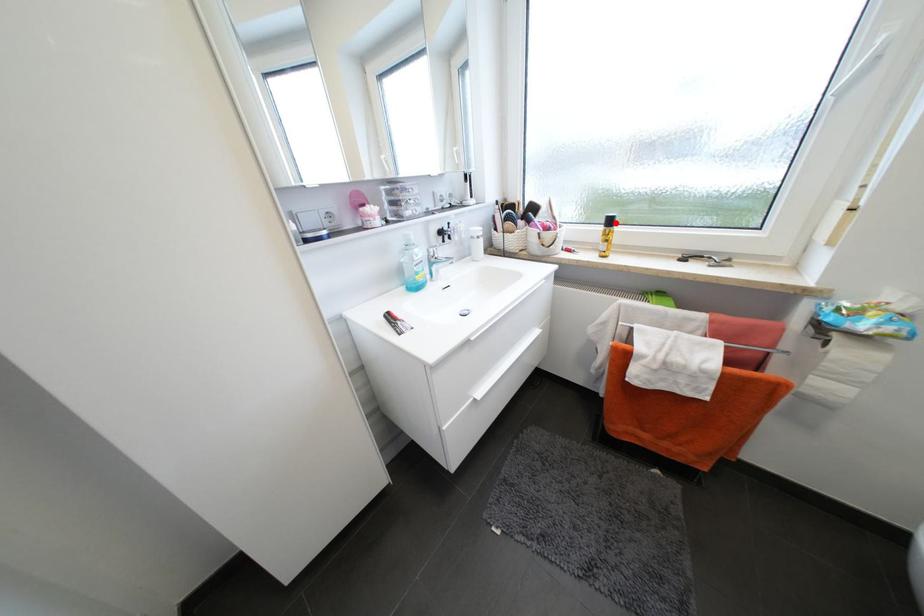
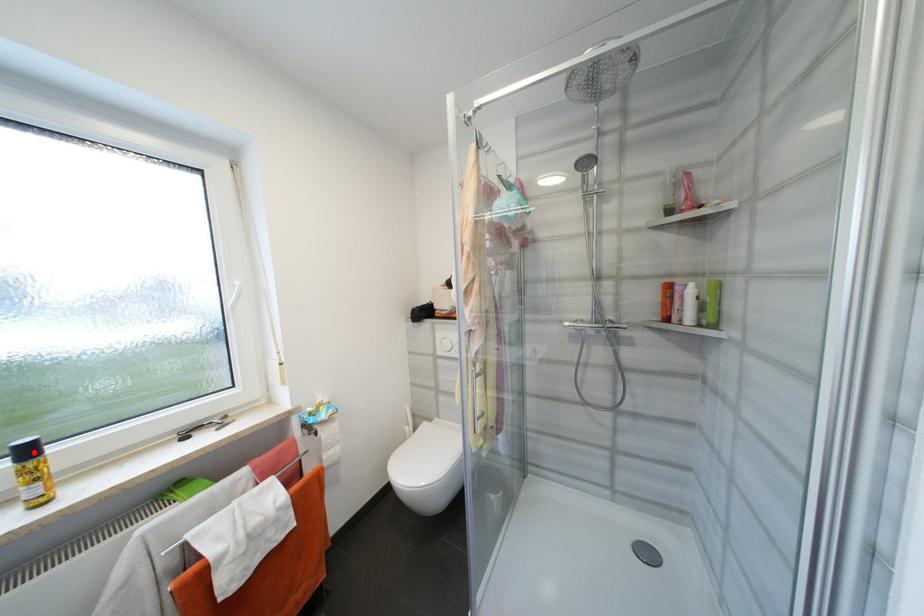
I am providing you with two images of the same scene from different viewpoints. A red point is marked on the first image and another point is marked on the second image. Are the points marked in image1 and image2 representing the same 3D position?

Yes